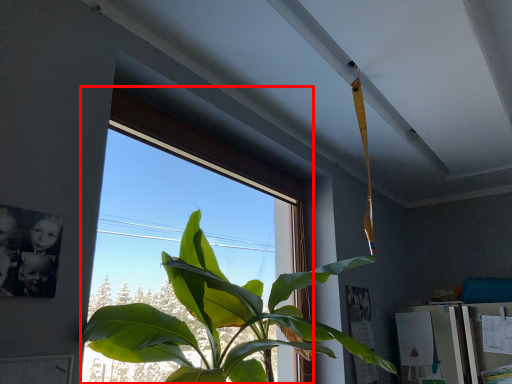
Question: Where is window (annotated by the red box) located in relation to houseplant in the image?

Choices:
 (A) left
 (B) right

Answer: (A)